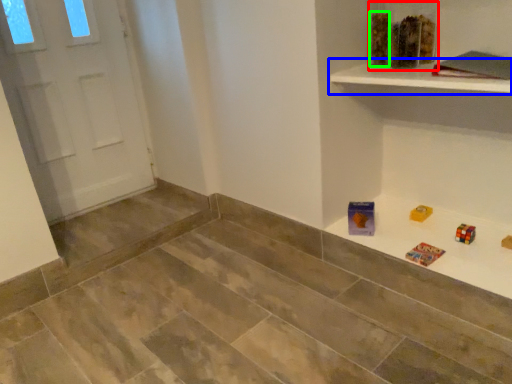
Question: Which object is positioned closest to toy (highlighted by a red box)? Select from shelf (highlighted by a blue box) and block (highlighted by a green box).

Choices:
 (A) shelf
 (B) block

Answer: (B)